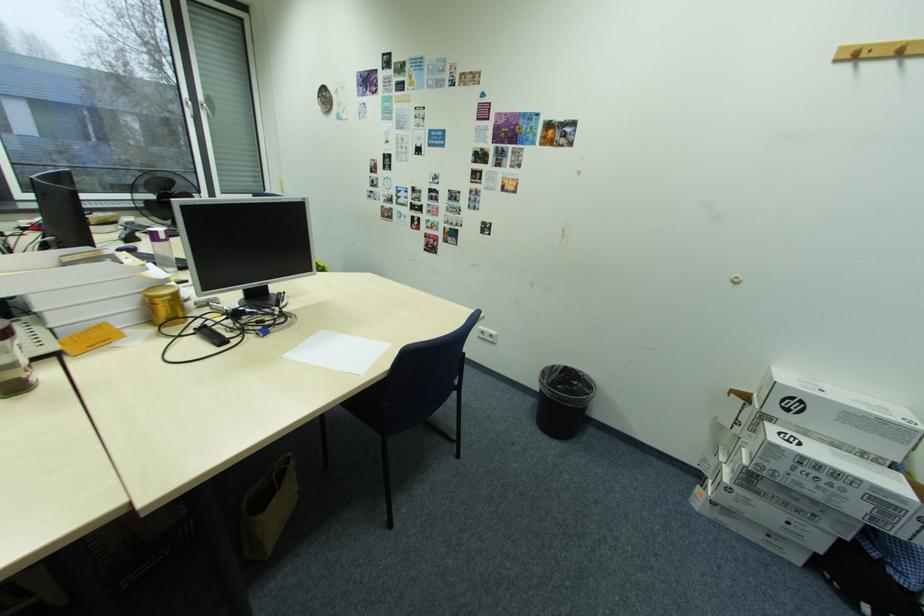
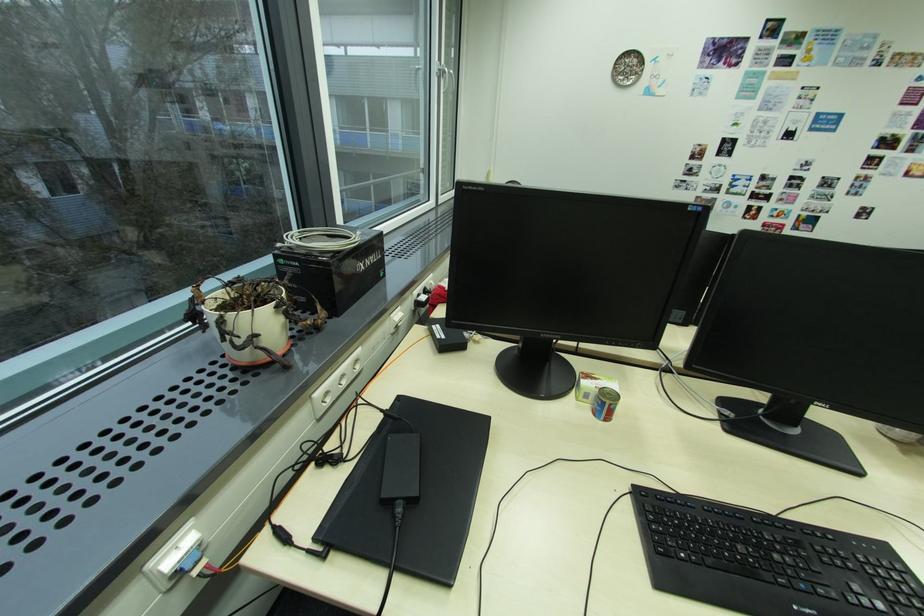
Question: In a continuous first-person perspective shot, in which direction is the camera moving?

Choices:
 (A) Left
 (B) Right
 (C) Forward
 (D) Backward

Answer: (A)